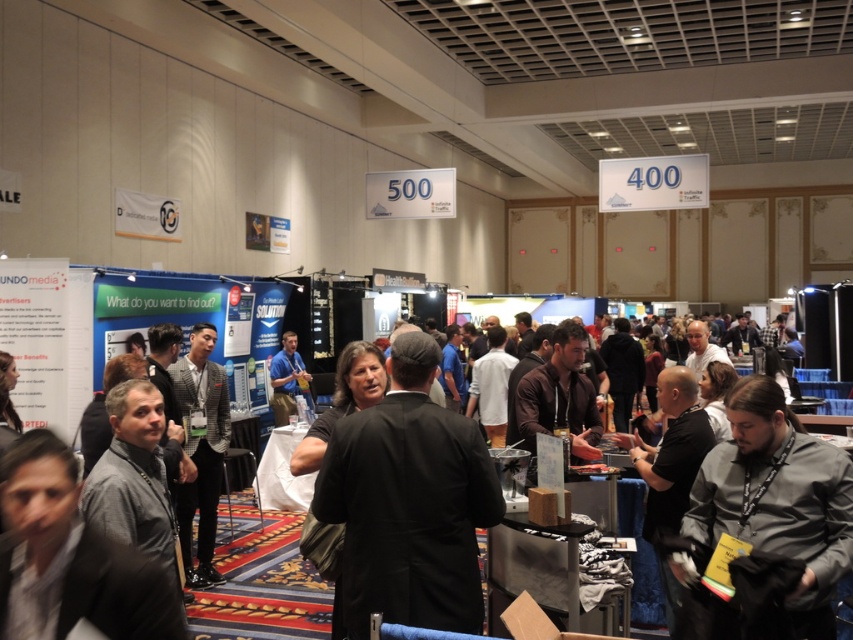
Question: Which point appears closest to the camera in this image?

Choices:
 (A) (440, 451)
 (B) (688, 520)

Answer: (A)

Question: Does black suit at center appear under gray fabric shirt at lower right?

Choices:
 (A) no
 (B) yes

Answer: (B)

Question: Does black suit at center appear under gray fabric shirt at lower right?

Choices:
 (A) no
 (B) yes

Answer: (B)

Question: Which object appears farthest from the camera in this image?

Choices:
 (A) black suit at center
 (B) gray fabric shirt at lower right

Answer: (A)

Question: Can you confirm if black suit at center is positioned below gray fabric shirt at lower right?

Choices:
 (A) no
 (B) yes

Answer: (B)